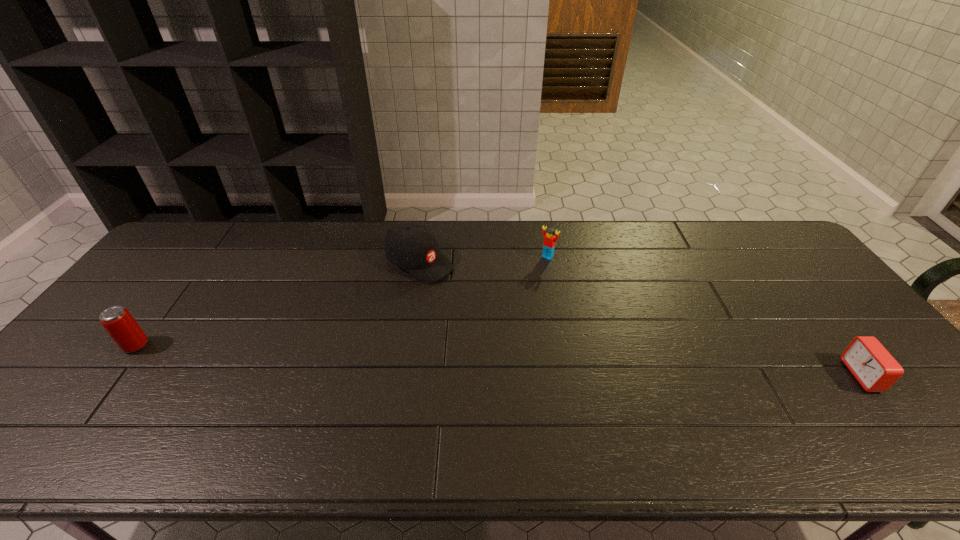
In order to click on object present at the right edge in this screenshot , I will do `click(875, 369)`.

This screenshot has height=540, width=960. Identify the location of object that is at the near right corner. (875, 369).

This screenshot has height=540, width=960. I want to click on free region at the far edge of the desktop, so click(x=451, y=261).

Where is `vacant space at the near edge of the desktop`? The height and width of the screenshot is (540, 960). vacant space at the near edge of the desktop is located at coordinates (371, 397).

Identify the location of vacant space at the right edge of the desktop. (788, 271).

This screenshot has width=960, height=540. I want to click on free space between the third object from left to right and the beer can, so click(x=342, y=301).

This screenshot has height=540, width=960. Identify the location of vacant area that lies between the second nearest object and the baseball cap. (277, 304).

Where is `free spot between the baseball cap and the third object from left to right`? The width and height of the screenshot is (960, 540). free spot between the baseball cap and the third object from left to right is located at coordinates (484, 260).

What are the coordinates of `empty space that is in between the alarm clock and the beer can` in the screenshot? It's located at [499, 361].

Locate an element on the screen. empty location between the Lego and the leftmost object is located at coordinates (342, 301).